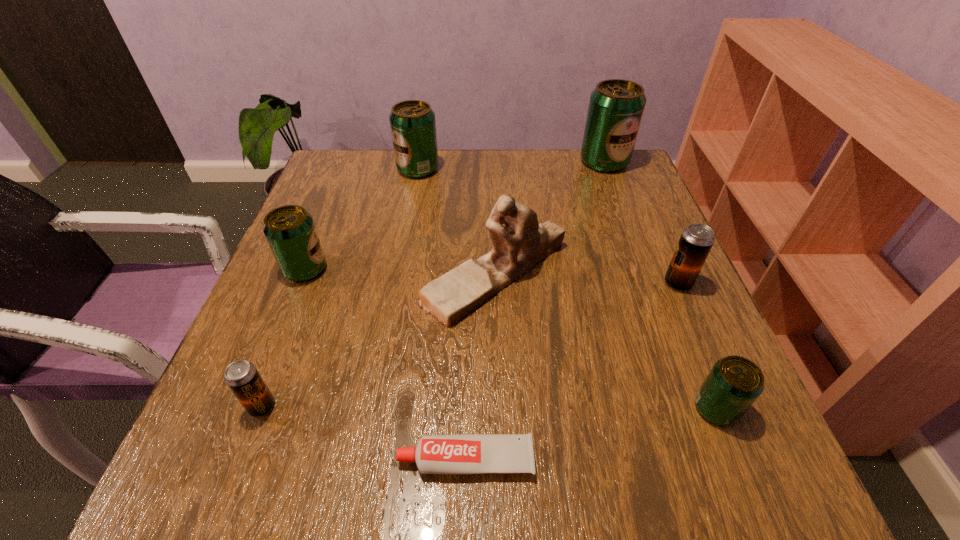
The image size is (960, 540). Identify the location of the biggest green beer can. (616, 106).

The width and height of the screenshot is (960, 540). What are the coordinates of `figurine` in the screenshot? It's located at (519, 242).

Find the location of a particular element. The height and width of the screenshot is (540, 960). the second biggest green beer can is located at coordinates (413, 127).

Find the location of a particular element. This screenshot has height=540, width=960. the fourth beer can from right to left is located at coordinates (413, 127).

Where is `the third farthest green beer can`? the third farthest green beer can is located at coordinates (290, 231).

Identify the location of the leftmost green beer can. The image size is (960, 540). (290, 231).

Image resolution: width=960 pixels, height=540 pixels. I want to click on the bigger black beer can, so click(x=696, y=241).

The height and width of the screenshot is (540, 960). I want to click on the farther black beer can, so click(x=696, y=241).

You are a GUI agent. You are given a task and a screenshot of the screen. Output one action in this format:
    pyautogui.click(x=<x>, y=<y>)
    Task: Click on the nearest green beer can
    This screenshot has height=540, width=960.
    Given the screenshot: What is the action you would take?
    pyautogui.click(x=734, y=383)

Locate an element on the screen. The width and height of the screenshot is (960, 540). the left black beer can is located at coordinates (242, 377).